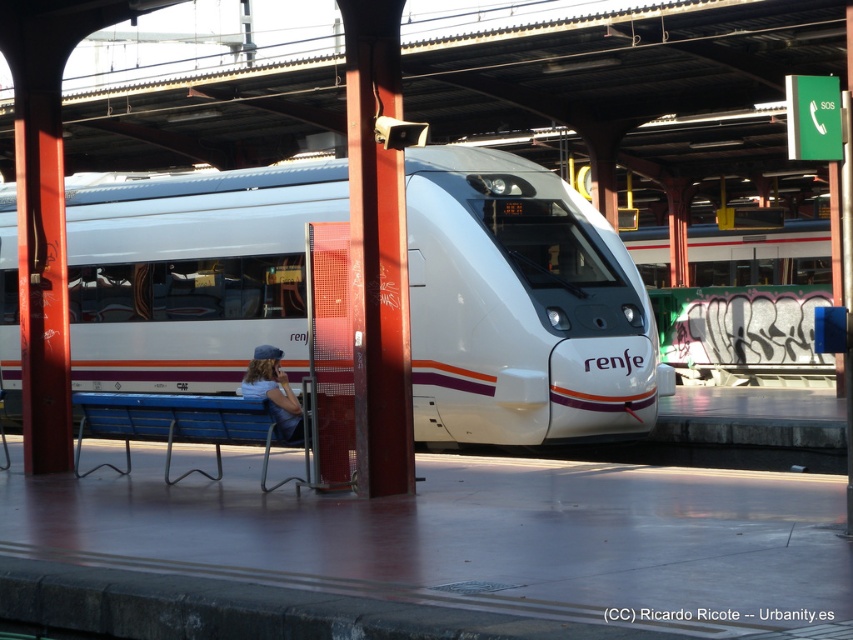
Consider the image. Can you confirm if white glossy train at center is wider than denim cap at center?

Yes, white glossy train at center is wider than denim cap at center.

Based on the photo, can you confirm if white glossy train at center is positioned above denim cap at center?

Indeed, white glossy train at center is positioned over denim cap at center.

Between point (340, 211) and point (276, 417), which one is positioned in front?

Point (276, 417) is in front.

Find the location of a particular element. The image size is (853, 640). white glossy train at center is located at coordinates (x=520, y=307).